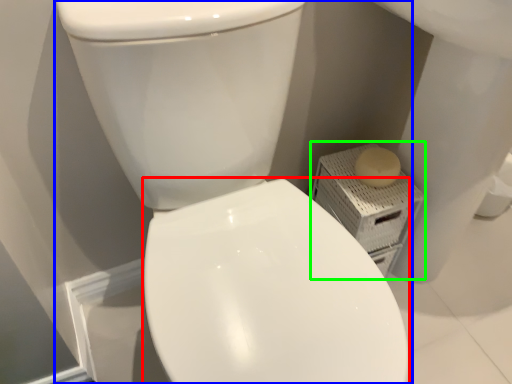
Question: Estimate the real-world distances between objects in this image. Which object is closer to bidet (highlighted by a red box), toilet (highlighted by a blue box) or porcelain (highlighted by a green box)?

Choices:
 (A) toilet
 (B) porcelain

Answer: (A)